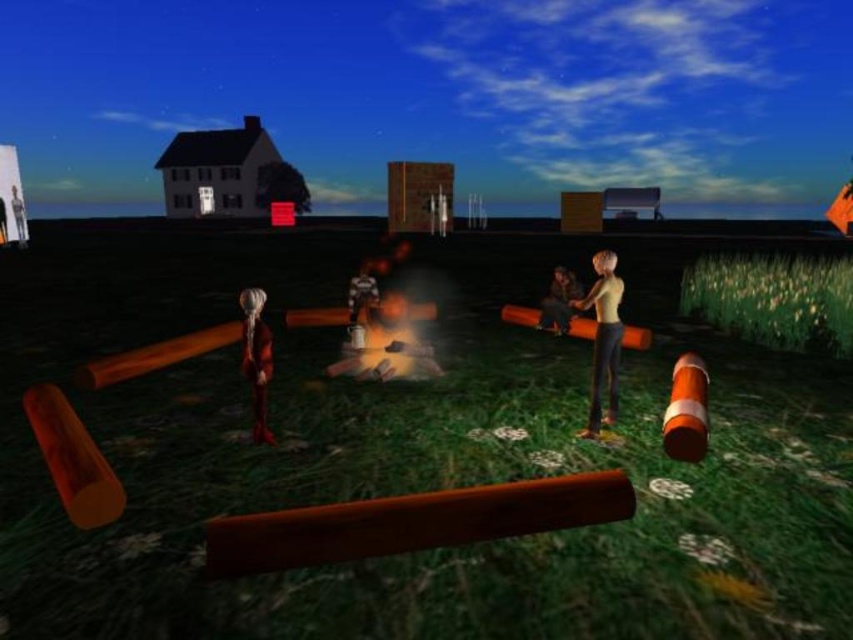
You are an avatar in the game and need to decide which item to pick up first. The leather jacket at center and the shiny metallic figure at center are both in your path. Based on their sizes, which one should you prioritize to avoid collision?

The leather jacket at center is bigger than the shiny metallic figure at center, so you should prioritize picking up the leather jacket at center first to avoid collision due to its larger size.

You are an avatar in the game and need to interact with both the smooth beige shirt at center right and the shiny metallic figure at center. Since you can only move forward or backward, which avatar should you approach first based on their positions?

You should approach the smooth beige shirt at center right first because it is in front of the shiny metallic figure at center, making it closer to you.